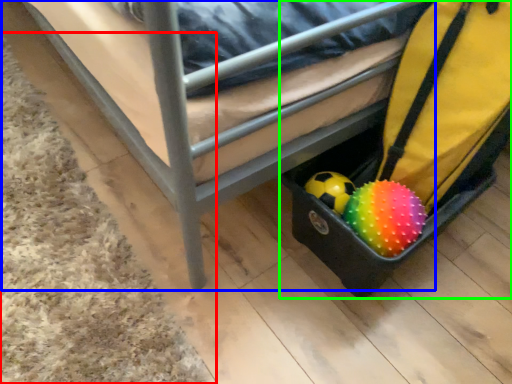
Question: Considering the real-world distances, which object is farthest from mat (highlighted by a red box)? furniture (highlighted by a blue box) or luggage (highlighted by a green box)?

Choices:
 (A) furniture
 (B) luggage

Answer: (B)